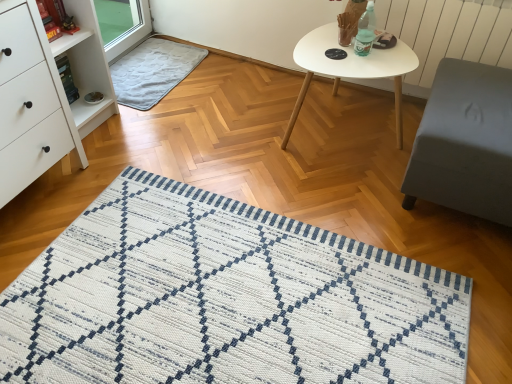
This screenshot has width=512, height=384. What are the coordinates of `free point to the left of white matte oval table at upper center` in the screenshot? It's located at (239, 156).